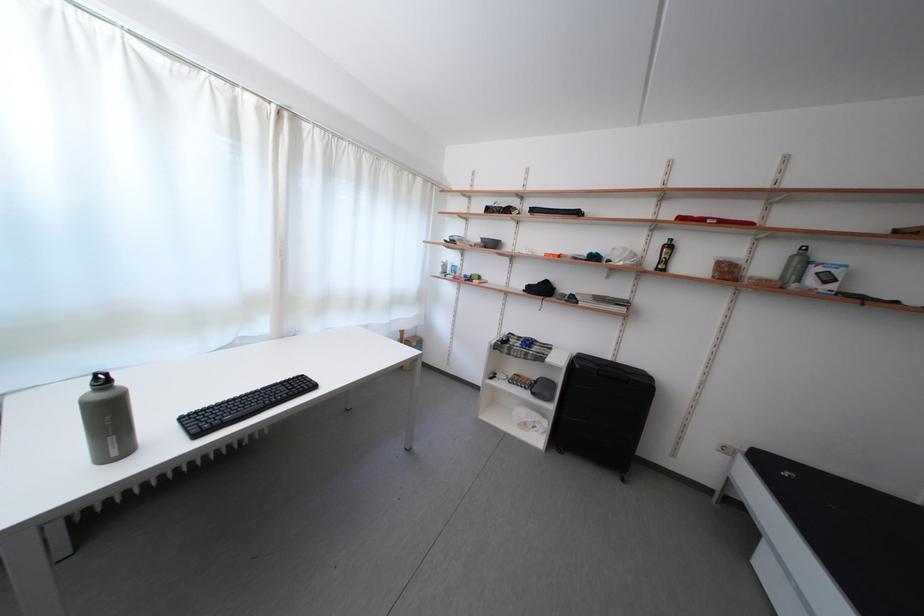
This screenshot has width=924, height=616. What are the coordinates of `clear water bottle` in the screenshot? It's located at (795, 267).